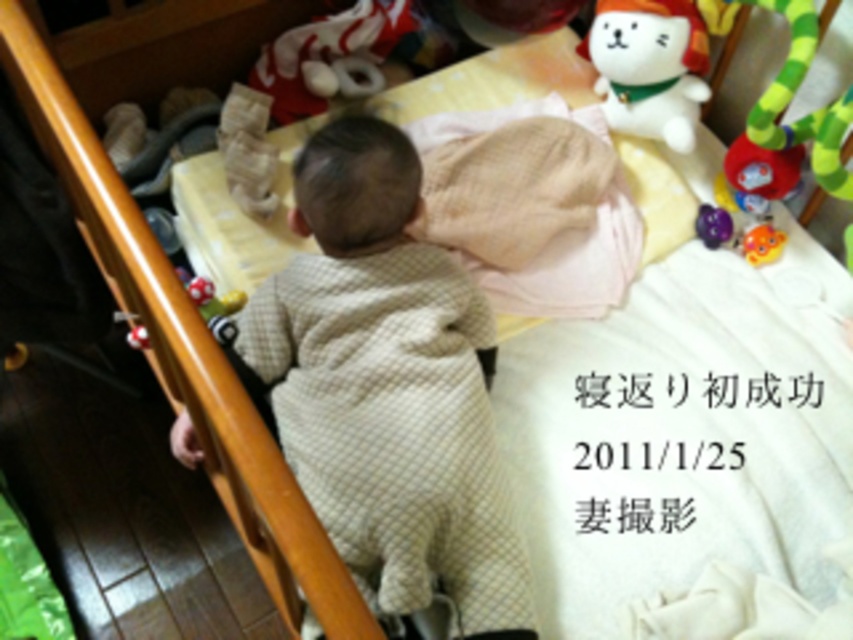
Is white plush cat at upper right bigger than yellow rubber duck at upper right?

Indeed, white plush cat at upper right has a larger size compared to yellow rubber duck at upper right.

Which is above, white plush cat at upper right or yellow rubber duck at upper right?

white plush cat at upper right is above.

Between point (640, 44) and point (746, 259), which one is positioned behind?

Point (746, 259)

Where is `white plush cat at upper right`? white plush cat at upper right is located at coordinates (648, 67).

Can you confirm if light beige fabric baby at center is shorter than yellow rubber duck at upper right?

In fact, light beige fabric baby at center may be taller than yellow rubber duck at upper right.

Does point (424, 376) come behind point (767, 228)?

No, (424, 376) is closer to viewer.

Is point (497, 522) more distant than point (763, 228)?

No, it is in front of (763, 228).

Locate an element on the screen. The image size is (853, 640). light beige fabric baby at center is located at coordinates (387, 388).

How distant is light beige fabric baby at center from white plush cat at upper right?

light beige fabric baby at center is 60.91 centimeters away from white plush cat at upper right.

Between point (328, 305) and point (683, 58), which one is positioned in front?

Point (328, 305) is in front.

Describe the element at coordinates (387, 388) in the screenshot. This screenshot has height=640, width=853. I see `light beige fabric baby at center` at that location.

At what (x,y) coordinates should I click in order to perform the action: click on light beige fabric baby at center. Please return your answer as a coordinate pair (x, y). The image size is (853, 640). Looking at the image, I should click on (387, 388).